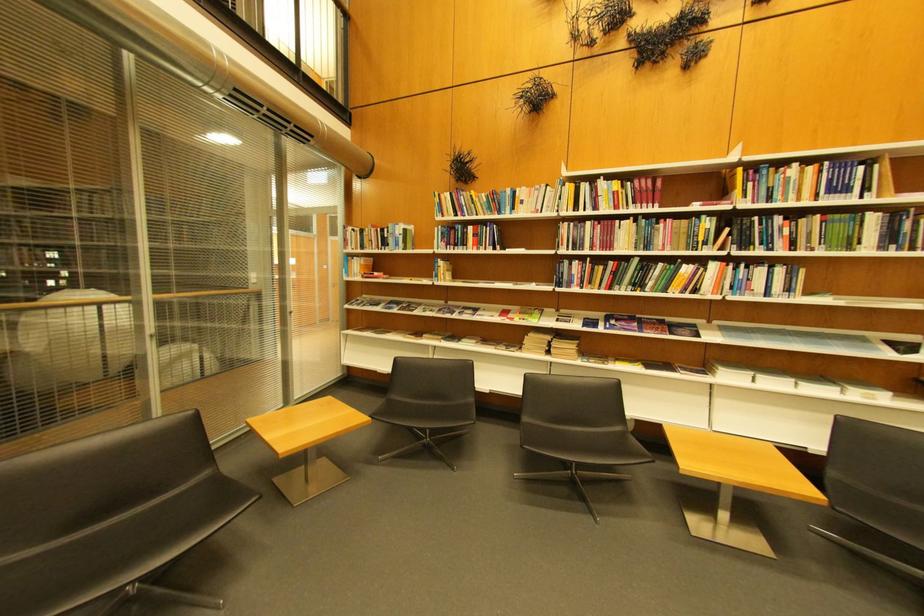
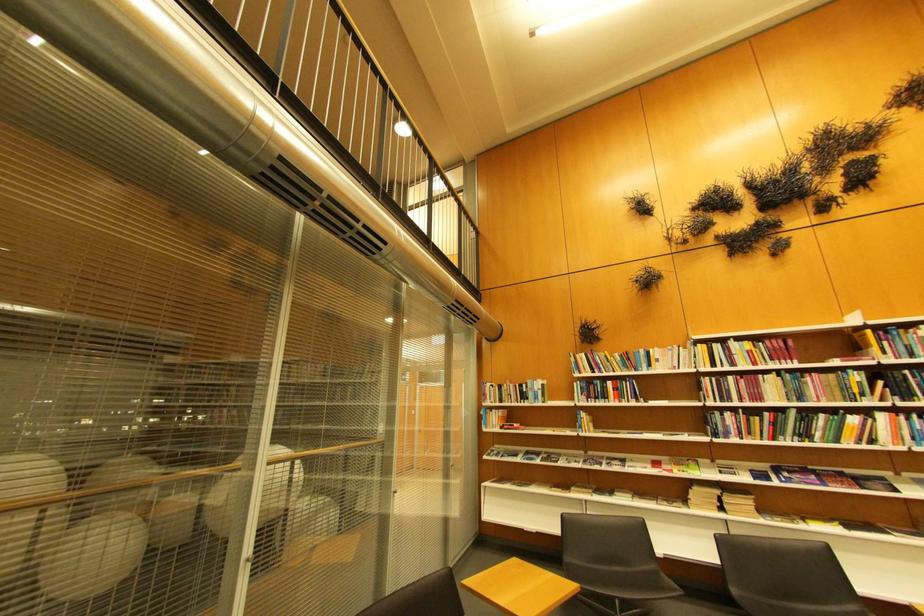
The point at [518,209] is marked in the first image. Where is the corresponding point in the second image?

(654, 368)